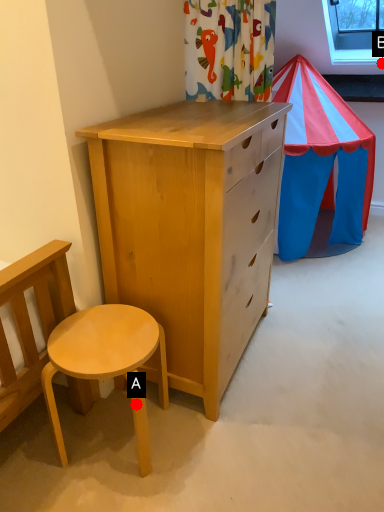
Question: Two points are circled on the image, labeled by A and B beside each circle. Among these points, which one is farthest from the camera?

Choices:
 (A) A is further
 (B) B is further

Answer: (B)